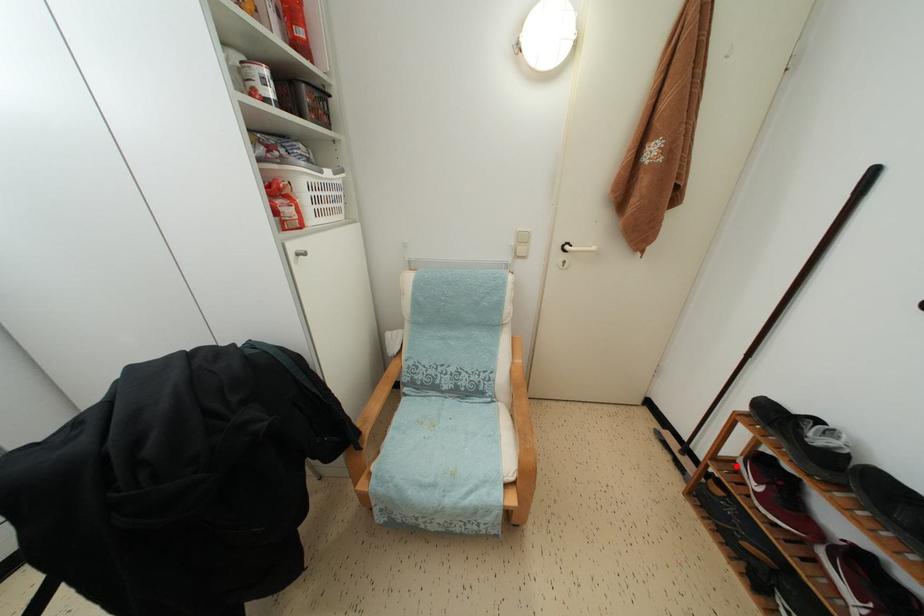
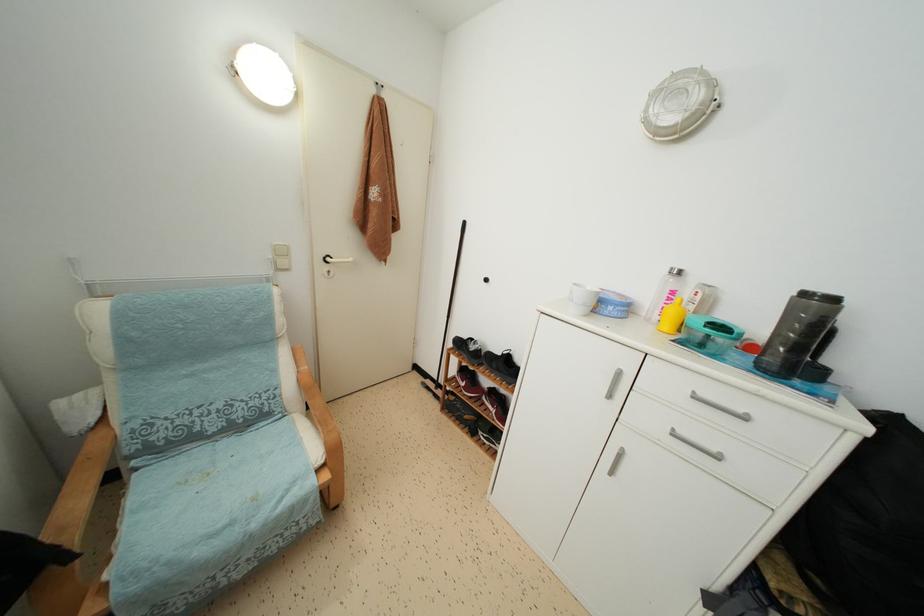
Question: I am providing you with two images of the same scene from different viewpoints. Given a red point in image1, look at the same physical point in image2. Is it:

Choices:
 (A) Closer to the viewpoint
 (B) Farther from the viewpoint

Answer: (B)